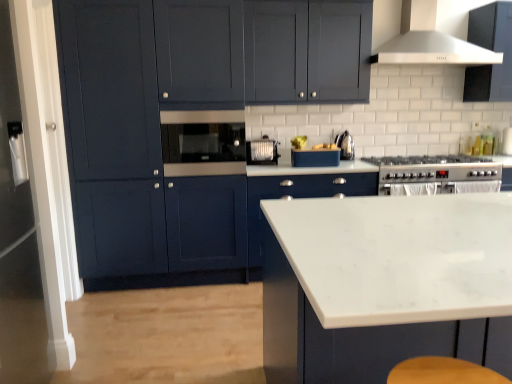
Question: Is white glossy cabinet at center, the first cabinetry from the back, wider than white plastic toaster at center, which is counted as the first appliance, starting from the left?

Choices:
 (A) yes
 (B) no

Answer: (A)

Question: Does white glossy cabinet at center, which is counted as the fourth cabinetry, starting from the front, have a greater height compared to white plastic toaster at center, the 2th appliance positioned from the right?

Choices:
 (A) no
 (B) yes

Answer: (B)

Question: From the image's perspective, is white glossy cabinet at center, which is counted as the fourth cabinetry, starting from the front, on top of white plastic toaster at center, which is counted as the first appliance, starting from the left?

Choices:
 (A) yes
 (B) no

Answer: (B)

Question: Does white glossy cabinet at center, which is counted as the fourth cabinetry, starting from the front, appear on the left side of white plastic toaster at center, the 2th appliance positioned from the right?

Choices:
 (A) no
 (B) yes

Answer: (A)

Question: From a real-world perspective, is white glossy cabinet at center, which is counted as the fourth cabinetry, starting from the front, physically above white plastic toaster at center, the 2th appliance positioned from the right?

Choices:
 (A) yes
 (B) no

Answer: (B)

Question: Does white glossy cabinet at center, which is counted as the fourth cabinetry, starting from the front, appear on the right side of white plastic toaster at center, which is counted as the first appliance, starting from the left?

Choices:
 (A) no
 (B) yes

Answer: (B)

Question: Can you confirm if white marble countertop at center, marked as the 1th cabinetry in a front-to-back arrangement, is thinner than matte black microwave at center?

Choices:
 (A) no
 (B) yes

Answer: (A)

Question: Is white marble countertop at center, marked as the 1th cabinetry in a front-to-back arrangement, located outside matte black microwave at center?

Choices:
 (A) yes
 (B) no

Answer: (A)

Question: Is white marble countertop at center, the 4th cabinetry from the back, behind matte black microwave at center?

Choices:
 (A) no
 (B) yes

Answer: (A)

Question: Is white marble countertop at center, the 4th cabinetry from the back, wider than matte black microwave at center?

Choices:
 (A) yes
 (B) no

Answer: (A)

Question: Considering the relative sizes of white marble countertop at center, marked as the 1th cabinetry in a front-to-back arrangement, and matte black microwave at center in the image provided, is white marble countertop at center, marked as the 1th cabinetry in a front-to-back arrangement, bigger than matte black microwave at center?

Choices:
 (A) no
 (B) yes

Answer: (B)

Question: From a real-world perspective, is white marble countertop at center, marked as the 1th cabinetry in a front-to-back arrangement, below matte black microwave at center?

Choices:
 (A) no
 (B) yes

Answer: (B)

Question: Does silver metallic gas stove at center right have a greater height compared to white glossy cabinet at center, which is counted as the fourth cabinetry, starting from the front?

Choices:
 (A) yes
 (B) no

Answer: (B)